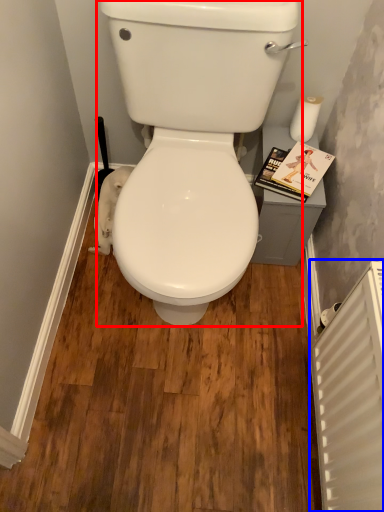
Question: Which of the following is the farthest to the observer, porcelain (highlighted by a red box) or radiator (highlighted by a blue box)?

Choices:
 (A) porcelain
 (B) radiator

Answer: (A)